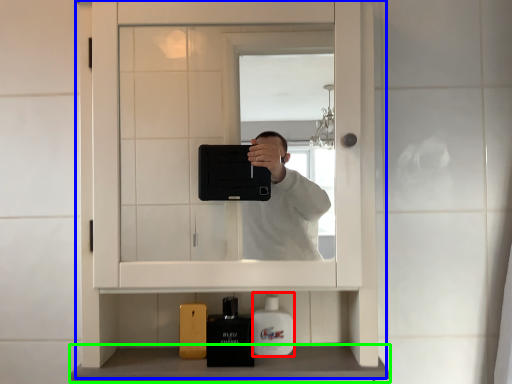
Question: Which is nearer to the mouthwash (highlighted by a red box)? medicine cabinet (highlighted by a blue box) or counter top (highlighted by a green box).

Choices:
 (A) medicine cabinet
 (B) counter top

Answer: (B)